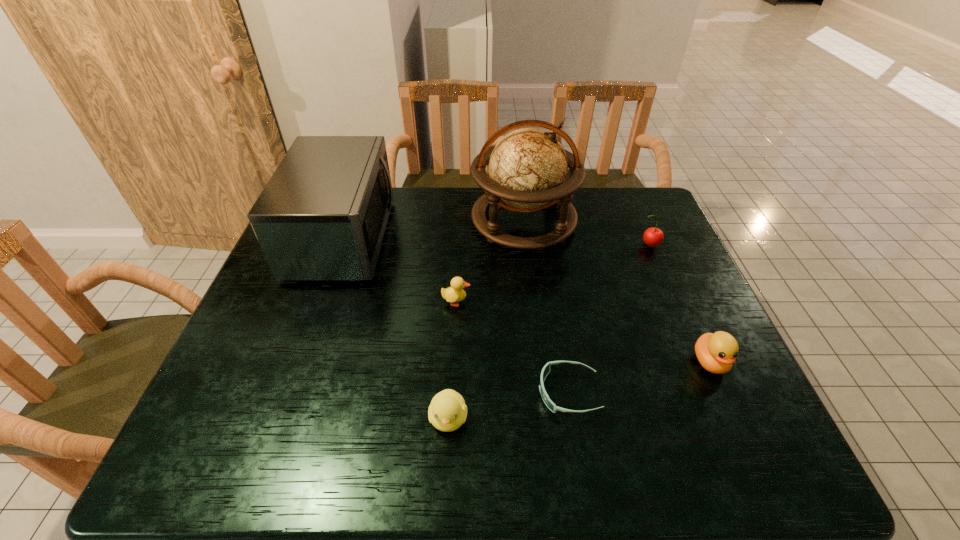
Where is `free region located 0.150m on the left of the third tallest object`? free region located 0.150m on the left of the third tallest object is located at coordinates (587, 245).

You are a GUI agent. You are given a task and a screenshot of the screen. Output one action in this format:
    pyautogui.click(x=<x>, y=<y>)
    Task: Click on the vacant space located on the face of the second farthest duckling
    Image resolution: width=960 pixels, height=540 pixels.
    Given the screenshot: What is the action you would take?
    pyautogui.click(x=746, y=442)

At what (x,y) coordinates should I click in order to perform the action: click on vacant area situated 0.060m on the front-facing side of the farthest duckling. Please return your answer as a coordinate pair (x, y). Looking at the image, I should click on 493,302.

The width and height of the screenshot is (960, 540). I want to click on vacant area situated on the front-facing side of the shortest object, so click(365, 393).

The image size is (960, 540). I want to click on vacant space located 0.380m on the front-facing side of the shortest object, so click(365, 393).

This screenshot has height=540, width=960. In order to click on vacant space located on the front-facing side of the shortest object in this screenshot , I will do `click(488, 393)`.

Locate an element on the screen. globe positioned at the far edge is located at coordinates (528, 168).

Where is `microwave oven that is at the far edge`? Image resolution: width=960 pixels, height=540 pixels. microwave oven that is at the far edge is located at coordinates (322, 216).

The image size is (960, 540). In order to click on object that is at the near edge in this screenshot , I will do `click(447, 412)`.

Where is `object present at the left edge`? The height and width of the screenshot is (540, 960). object present at the left edge is located at coordinates 322,216.